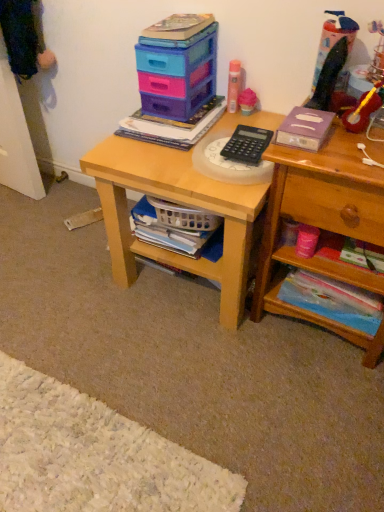
Describe the element at coordinates (180, 203) in the screenshot. The image size is (384, 512). I see `light wood desk at center` at that location.

Describe the element at coordinates (247, 145) in the screenshot. I see `black plastic calculator at center` at that location.

Image resolution: width=384 pixels, height=512 pixels. What do you see at coordinates (323, 224) in the screenshot?
I see `wooden at right` at bounding box center [323, 224].

Find the location of `white plastic basket at lower center, acting as the third book starting from the top`. white plastic basket at lower center, acting as the third book starting from the top is located at coordinates (177, 230).

The height and width of the screenshot is (512, 384). Find the location of `matte plastic book at center, which is the 1th book in top-to-bottom order`. matte plastic book at center, which is the 1th book in top-to-bottom order is located at coordinates (172, 126).

What do you see at coordinates (172, 126) in the screenshot? I see `matte plastic book at center, which is the 1th book in top-to-bottom order` at bounding box center [172, 126].

This screenshot has width=384, height=512. Describe the element at coordinates (333, 300) in the screenshot. I see `translucent plastic book at lower right, acting as the 1th book starting from the bottom` at that location.

This screenshot has height=512, width=384. Identify the location of translucent plastic toy at upper right, the 2th toy in the right-to-left sequence. (335, 42).

Is the surface of pink matte ice cream cone at upper center, acting as the 2th toy starting from the left, in direct contact with rubberized plastic pencil sharpener at upper right, the first toy in the right-to-left sequence?

There is a gap between pink matte ice cream cone at upper center, acting as the 2th toy starting from the left, and rubberized plastic pencil sharpener at upper right, the first toy in the right-to-left sequence.

From their relative heights in the image, would you say pink matte ice cream cone at upper center, acting as the 2th toy starting from the left, is taller or shorter than rubberized plastic pencil sharpener at upper right, which is counted as the fourth toy, starting from the left?

Considering their sizes, pink matte ice cream cone at upper center, acting as the 2th toy starting from the left, has less height than rubberized plastic pencil sharpener at upper right, which is counted as the fourth toy, starting from the left.

Between point (249, 89) and point (364, 111), which one is positioned behind?

The point (249, 89) is farther from the camera.

Is pink matte ice cream cone at upper center, acting as the 2th toy starting from the left, in front of or behind rubberized plastic pencil sharpener at upper right, the first toy in the right-to-left sequence, in the image?

In the image, pink matte ice cream cone at upper center, acting as the 2th toy starting from the left, appears behind rubberized plastic pencil sharpener at upper right, the first toy in the right-to-left sequence.

You are a GUI agent. You are given a task and a screenshot of the screen. Output one action in this format:
    pyautogui.click(x=<x>, y=<y>)
    Task: Click on the book that is the 1st object above the wooden at right (from a real-world perspective)
    This screenshot has width=384, height=512.
    Given the screenshot: What is the action you would take?
    pyautogui.click(x=172, y=126)

Which object is positioned more to the right, matte plastic book at center, which is the 1th book in top-to-bottom order, or wooden at right?

wooden at right.

Which of these two, matte plastic book at center, the fourth book from the bottom, or wooden at right, stands taller?

With more height is wooden at right.

Considering the relative sizes of translucent plastic book at lower right, acting as the 1th book starting from the bottom, and black plastic calculator at center in the image provided, is translucent plastic book at lower right, acting as the 1th book starting from the bottom, taller than black plastic calculator at center?

Correct, translucent plastic book at lower right, acting as the 1th book starting from the bottom, is much taller as black plastic calculator at center.

Is translucent plastic book at lower right, acting as the 1th book starting from the bottom, at the right side of black plastic calculator at center?

Correct, you'll find translucent plastic book at lower right, acting as the 1th book starting from the bottom, to the right of black plastic calculator at center.

Which of these two, translucent plastic book at lower right, acting as the fourth book starting from the top, or black plastic calculator at center, is smaller?

With smaller size is black plastic calculator at center.

From a real-world perspective, who is located lower, translucent plastic book at lower right, acting as the 1th book starting from the bottom, or black plastic calculator at center?

translucent plastic book at lower right, acting as the 1th book starting from the bottom, is physically lower.

Is black plastic calculator at center facing towards translucent plastic toy at upper right, the 2th toy in the right-to-left sequence?

No.

From the image's perspective, is black plastic calculator at center beneath translucent plastic toy at upper right, the 2th toy in the right-to-left sequence?

Yes, from the image's perspective, black plastic calculator at center is beneath translucent plastic toy at upper right, the 2th toy in the right-to-left sequence.

Is black plastic calculator at center in contact with translucent plastic toy at upper right, the 2th toy in the right-to-left sequence?

No, black plastic calculator at center is not beside translucent plastic toy at upper right, the 2th toy in the right-to-left sequence.

Which point is more forward, (300, 106) or (306, 193)?

Point (306, 193)

Do you think purple matte book at upper right, which is the 3th book from bottom to top, is within wooden at right, or outside of it?

purple matte book at upper right, which is the 3th book from bottom to top, is located beyond the bounds of wooden at right.

Between purple matte book at upper right, which is the 3th book from bottom to top, and wooden at right, which one has less height?

purple matte book at upper right, which is the 3th book from bottom to top.

Is rubberized plastic pencil sharpener at upper right, the first toy in the right-to-left sequence, to the right of pink matte ice cream cone at upper center, placed as the 3th toy when sorted from right to left, from the viewer's perspective?

Correct, you'll find rubberized plastic pencil sharpener at upper right, the first toy in the right-to-left sequence, to the right of pink matte ice cream cone at upper center, placed as the 3th toy when sorted from right to left.

I want to click on the 2nd toy positioned above the pink matte ice cream cone at upper center, acting as the 2th toy starting from the left (from a real-world perspective), so point(363,110).

Based on the photo, how many degrees apart are the facing directions of rubberized plastic pencil sharpener at upper right, which is counted as the fourth toy, starting from the left, and pink matte ice cream cone at upper center, acting as the 2th toy starting from the left?

The angle between the facing direction of rubberized plastic pencil sharpener at upper right, which is counted as the fourth toy, starting from the left, and the facing direction of pink matte ice cream cone at upper center, acting as the 2th toy starting from the left, is 0.731 degrees.

Can you confirm if rubberized plastic pencil sharpener at upper right, the first toy in the right-to-left sequence, is taller than pink matte ice cream cone at upper center, acting as the 2th toy starting from the left?

Yes, rubberized plastic pencil sharpener at upper right, the first toy in the right-to-left sequence, is taller than pink matte ice cream cone at upper center, acting as the 2th toy starting from the left.

Is point (221, 206) closer or farther from the camera than point (334, 206)?

Point (221, 206) appears to be farther away from the viewer than point (334, 206).

Is light wood desk at center next to wooden at right?

light wood desk at center and wooden at right are clearly separated.

From a real-world perspective, relative to wooden at right, is light wood desk at center vertically above or below?

In terms of real-world spatial position, light wood desk at center is below wooden at right.

Which toy is the 2nd one when counting from the right side of the pink matte ice cream cone at upper center, acting as the 2th toy starting from the left? Please provide its 2D coordinates.

[(363, 110)]

Identify the location of shelf in front of the matte plastic book at center, which is the 1th book in top-to-bottom order. (323, 224).

Consider the image. Estimate the real-world distances between objects in this image. Which object is further from pink matte ice cream cone at upper center, placed as the 3th toy when sorted from right to left, plastic storage boxes at upper center or pink matte spray can at upper center, positioned as the first toy in left-to-right order?

Among the two, plastic storage boxes at upper center is located further to pink matte ice cream cone at upper center, placed as the 3th toy when sorted from right to left.

Looking at this image, estimate the real-world distances between objects in this image. Which object is closer to pink matte ice cream cone at upper center, placed as the 3th toy when sorted from right to left, black plastic calculator at center or plastic storage boxes at upper center?

plastic storage boxes at upper center lies closer to pink matte ice cream cone at upper center, placed as the 3th toy when sorted from right to left, than the other object.

When comparing their distances from pink matte spray can at upper center, positioned as the 4th toy in right-to-left order, does light wood desk at center or wooden at right seem closer?

light wood desk at center is positioned closer to the anchor pink matte spray can at upper center, positioned as the 4th toy in right-to-left order.

Estimate the real-world distances between objects in this image. Which object is closer to wooden at right, rubberized plastic pencil sharpener at upper right, the first toy in the right-to-left sequence, or black plastic calculator at center?

The object closer to wooden at right is black plastic calculator at center.

Looking at the image, which one is located further to pink matte spray can at upper center, positioned as the first toy in left-to-right order, purple matte book at upper right, the 2th book in the top-to-bottom sequence, or pink matte ice cream cone at upper center, placed as the 3th toy when sorted from right to left?

purple matte book at upper right, the 2th book in the top-to-bottom sequence.

Estimate the real-world distances between objects in this image. Which object is closer to white plastic basket at lower center, acting as the third book starting from the top, pink matte ice cream cone at upper center, acting as the 2th toy starting from the left, or translucent plastic book at lower right, acting as the 1th book starting from the bottom?

translucent plastic book at lower right, acting as the 1th book starting from the bottom, lies closer to white plastic basket at lower center, acting as the third book starting from the top, than the other object.

In the scene shown: Based on their spatial positions, is translucent plastic toy at upper right, the 2th toy in the right-to-left sequence, or black plastic calculator at center closer to pink matte spray can at upper center, positioned as the 4th toy in right-to-left order?

black plastic calculator at center is positioned closer to the anchor pink matte spray can at upper center, positioned as the 4th toy in right-to-left order.

Estimate the real-world distances between objects in this image. Which object is further from plastic storage boxes at upper center, pink matte ice cream cone at upper center, placed as the 3th toy when sorted from right to left, or wooden at right?

wooden at right is positioned further to the anchor plastic storage boxes at upper center.

At what (x,y) coordinates should I click in order to perform the action: click on calculator located between plastic storage boxes at upper center and translucent plastic toy at upper right, the 3th toy from the left, in the left-right direction. Please return your answer as a coordinate pair (x, y). Looking at the image, I should click on (247, 145).

Identify the location of calculator between matte plastic book at center, the fourth book from the bottom, and light wood desk at center, in the vertical direction. (247, 145).

Where is `shelf that lies between pink matte ice cream cone at upper center, acting as the 2th toy starting from the left, and translucent plastic book at lower right, acting as the 1th book starting from the bottom, from top to bottom`? The width and height of the screenshot is (384, 512). shelf that lies between pink matte ice cream cone at upper center, acting as the 2th toy starting from the left, and translucent plastic book at lower right, acting as the 1th book starting from the bottom, from top to bottom is located at coordinates (323, 224).

Where is `desk between white plastic basket at lower center, which ranks as the second book in bottom-to-top order, and rubberized plastic pencil sharpener at upper right, which is counted as the fourth toy, starting from the left`? desk between white plastic basket at lower center, which ranks as the second book in bottom-to-top order, and rubberized plastic pencil sharpener at upper right, which is counted as the fourth toy, starting from the left is located at coordinates (180, 203).